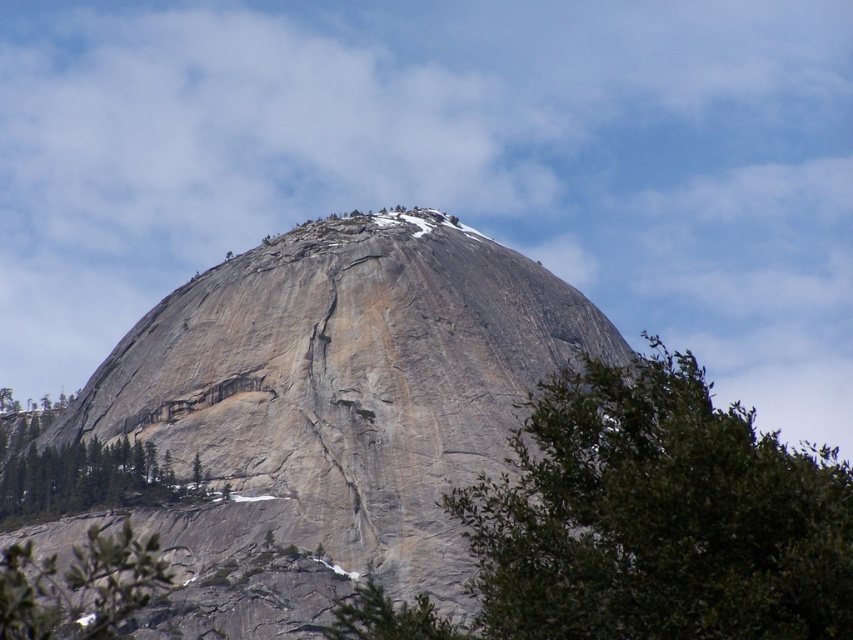
Question: Is green textured tree at lower left further to the viewer compared to green leafy tree at lower left?

Choices:
 (A) yes
 (B) no

Answer: (A)

Question: Where is gray rock formation at center located in relation to green leafy tree at lower left in the image?

Choices:
 (A) right
 (B) left

Answer: (A)

Question: Which object appears farthest from the camera in this image?

Choices:
 (A) green textured tree at lower left
 (B) green leafy tree at lower left

Answer: (A)

Question: In this image, where is green leafy tree at center located relative to green textured tree at lower left?

Choices:
 (A) above
 (B) below

Answer: (B)

Question: Among these objects, which one is nearest to the camera?

Choices:
 (A) green textured tree at lower left
 (B) green leafy tree at lower left
 (C) green leafy tree at center

Answer: (C)

Question: Which object is farther from the camera taking this photo?

Choices:
 (A) gray rock formation at center
 (B) green leafy tree at lower left

Answer: (A)